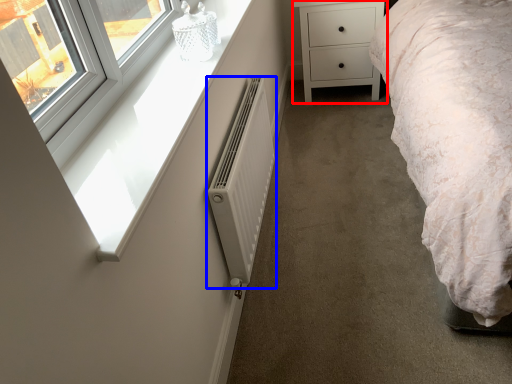
Question: Which point is closer to the camera, chest of drawers (highlighted by a red box) or radiator (highlighted by a blue box)?

Choices:
 (A) chest of drawers
 (B) radiator

Answer: (B)